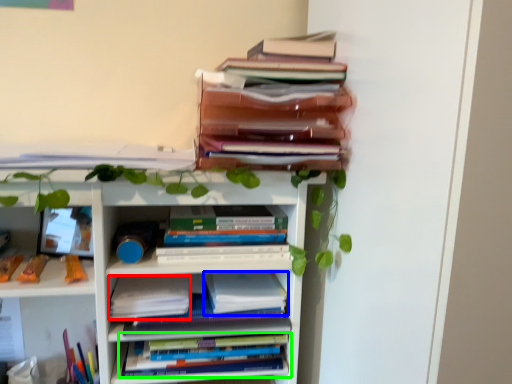
Question: Estimate the real-world distances between objects in this image. Which object is farther from paperback book (highlighted by a red box), paperback book (highlighted by a blue box) or book (highlighted by a green box)?

Choices:
 (A) paperback book
 (B) book

Answer: (B)